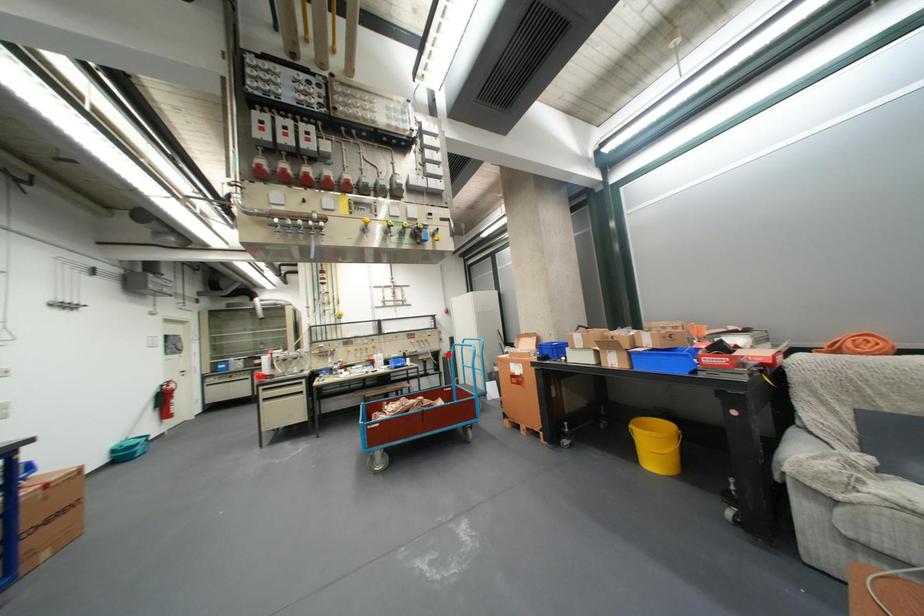
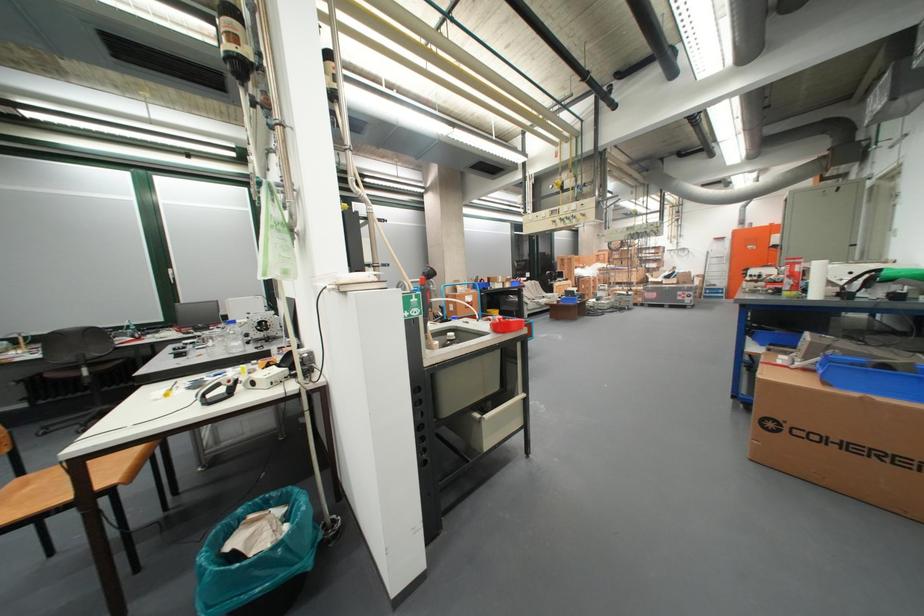
Question: I am providing you with two images of the same scene from different viewpoints. A red point is marked on the first image. Can you still see the location of the red point in image 2?

Choices:
 (A) Yes
 (B) No

Answer: (B)